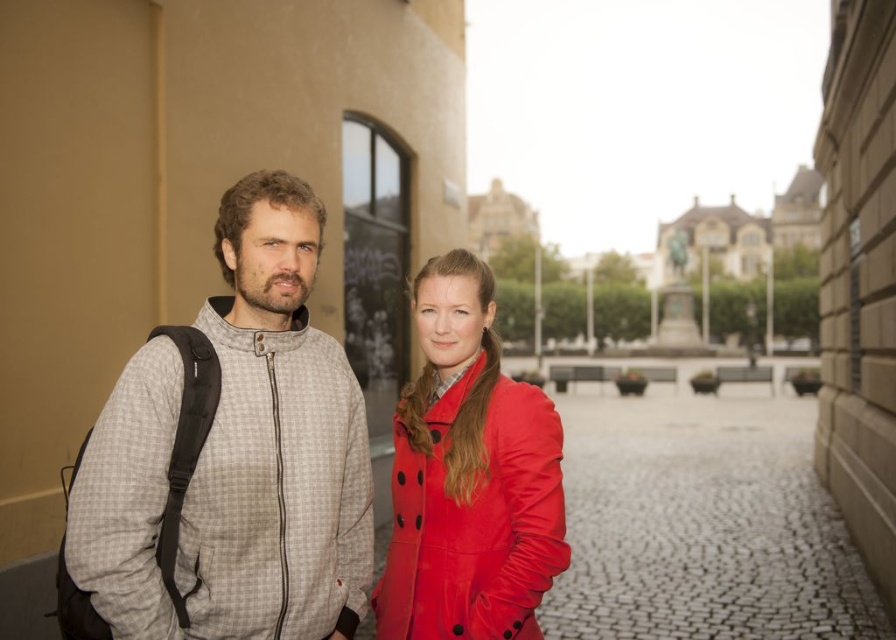
Question: Which of the following is the closest to the observer?

Choices:
 (A) shiny red coat at center
 (B) gray checkered jacket at left

Answer: (B)

Question: Is gray checkered jacket at left positioned before shiny red coat at center?

Choices:
 (A) yes
 (B) no

Answer: (A)

Question: Is gray checkered jacket at left below shiny red coat at center?

Choices:
 (A) yes
 (B) no

Answer: (B)

Question: In this image, where is gray checkered jacket at left located relative to shiny red coat at center?

Choices:
 (A) above
 (B) below

Answer: (A)